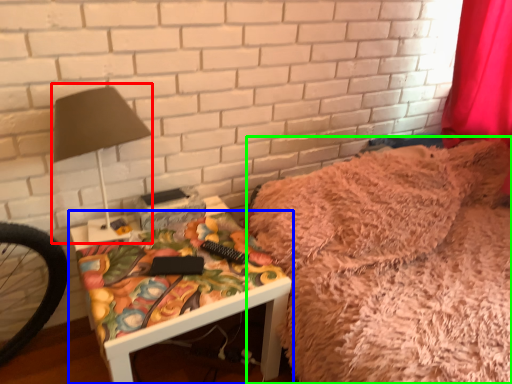
Question: Estimate the real-world distances between objects in this image. Which object is farther from table lamp (highlighted by a red box), furniture (highlighted by a blue box) or bed (highlighted by a green box)?

Choices:
 (A) furniture
 (B) bed

Answer: (B)